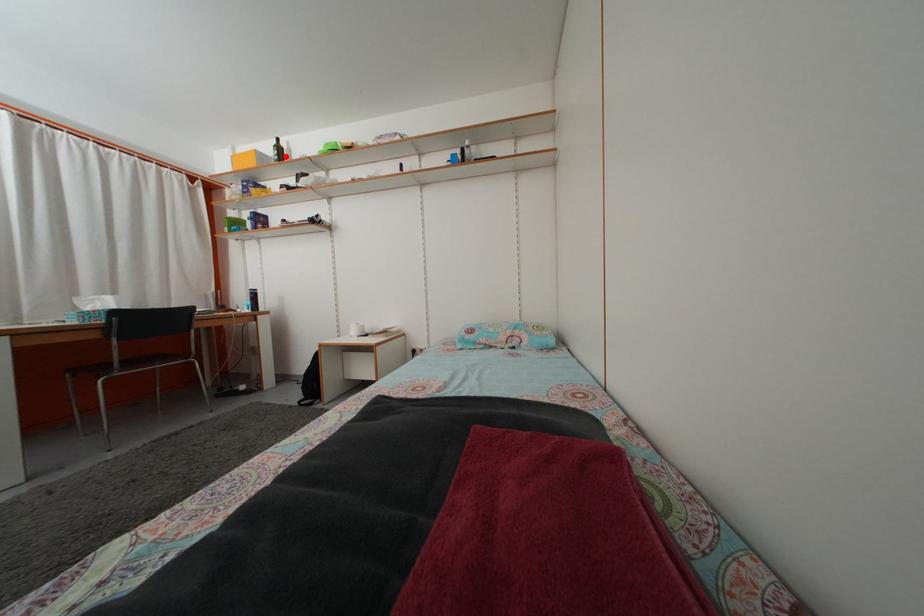
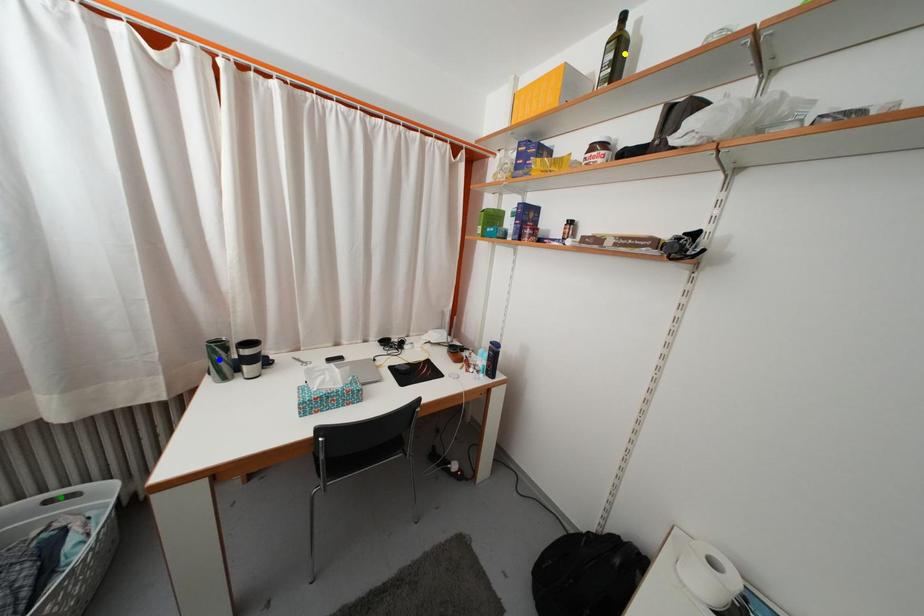
Question: I am providing you with two images of the same scene from different viewpoints. A red point is marked on the first image. You are given multiple points on the second image. Which point in image 2 represents the same 3d spot as the red point in image 1?

Choices:
 (A) green point
 (B) yellow point
 (C) blue point

Answer: (B)